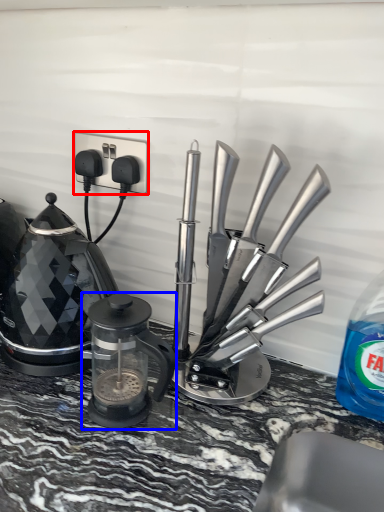
Question: Which object is closer to the camera taking this photo, electric outlet (highlighted by a red box) or kitchen appliance (highlighted by a blue box)?

Choices:
 (A) electric outlet
 (B) kitchen appliance

Answer: (B)